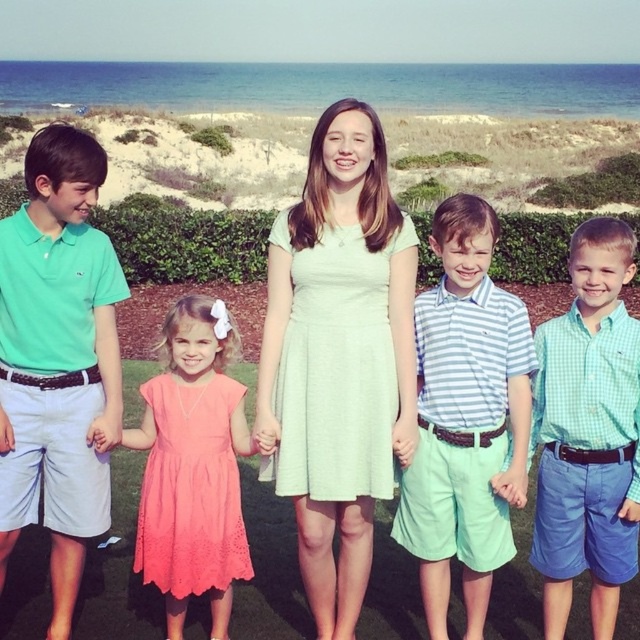
Question: Observing the image, what is the correct spatial positioning of light green dress at center in reference to coral lace dress at center?

Choices:
 (A) above
 (B) below

Answer: (A)

Question: Is matte green polo shirt at left positioned in front of green checkered shirt at center?

Choices:
 (A) no
 (B) yes

Answer: (A)

Question: Which point is farther to the camera?

Choices:
 (A) (38, 179)
 (B) (337, 406)
 (C) (532, 412)
 (D) (456, 317)

Answer: (C)

Question: Does striped cotton shirt at center appear under coral lace dress at center?

Choices:
 (A) yes
 (B) no

Answer: (B)

Question: Which point is closer to the camera?

Choices:
 (A) light green dress at center
 (B) striped cotton shirt at center

Answer: (B)

Question: Which object appears farthest from the camera in this image?

Choices:
 (A) green checkered shirt at center
 (B) matte green polo shirt at left
 (C) coral lace dress at center
 (D) striped cotton shirt at center

Answer: (C)